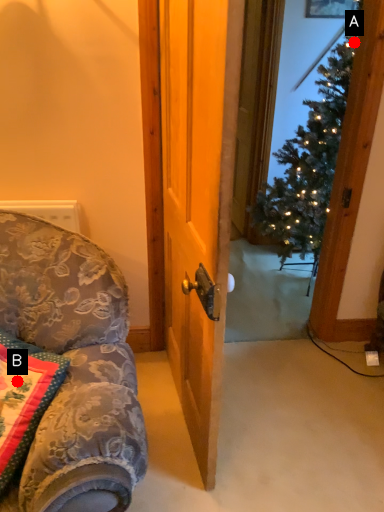
Question: Two points are circled on the image, labeled by A and B beside each circle. Which point is closer to the camera?

Choices:
 (A) A is closer
 (B) B is closer

Answer: (B)